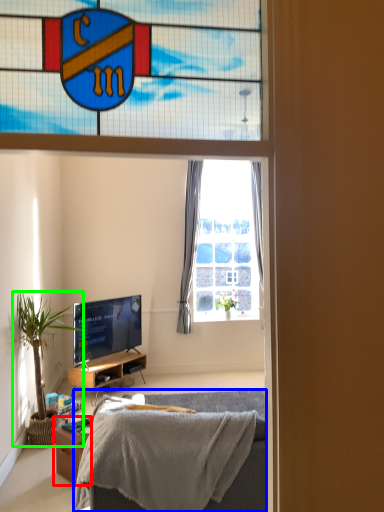
Question: Estimate the real-world distances between objects in this image. Which object is closer to desk (highlighted by a red box), bed (highlighted by a blue box) or houseplant (highlighted by a green box)?

Choices:
 (A) bed
 (B) houseplant

Answer: (B)